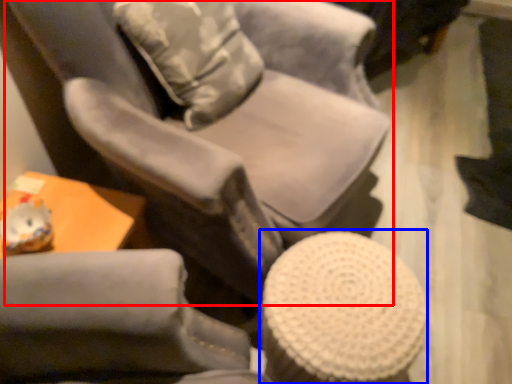
Question: Among these objects, which one is nearest to the camera, chair (highlighted by a red box) or bar stool (highlighted by a blue box)?

Choices:
 (A) chair
 (B) bar stool

Answer: (A)